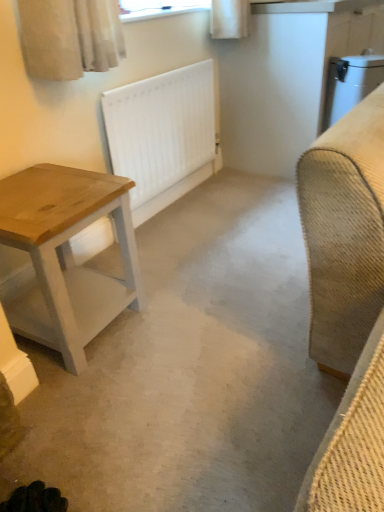
Question: From a real-world perspective, is white matte concrete at center physically located above or below white matte radiator at center?

Choices:
 (A) above
 (B) below

Answer: (B)

Question: Would you say white matte concrete at center is inside or outside white matte radiator at center?

Choices:
 (A) inside
 (B) outside

Answer: (B)

Question: Which of these objects is positioned closest to the white matte concrete at center?

Choices:
 (A) white matte radiator at center
 (B) wooden table at left

Answer: (B)

Question: Estimate the real-world distances between objects in this image. Which object is farther from the white matte concrete at center?

Choices:
 (A) wooden table at left
 (B) white matte radiator at center

Answer: (B)